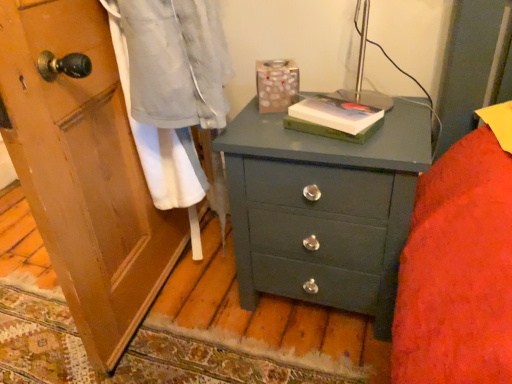
What are the coordinates of `free space in front of hardcover book at center, marked as the 1th book in a bottom-to-top arrangement` in the screenshot? It's located at (352, 142).